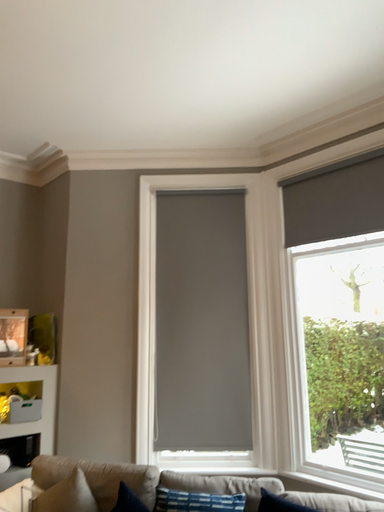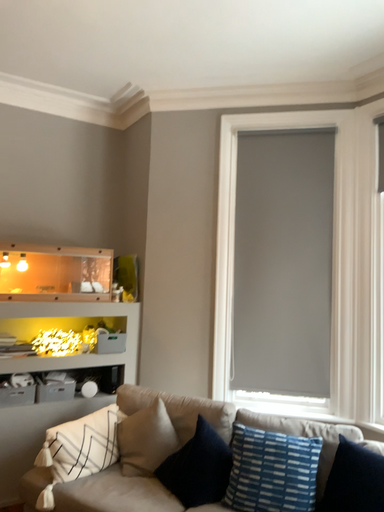
Question: How did the camera likely rotate when shooting the video?

Choices:
 (A) rotated left
 (B) rotated right

Answer: (A)